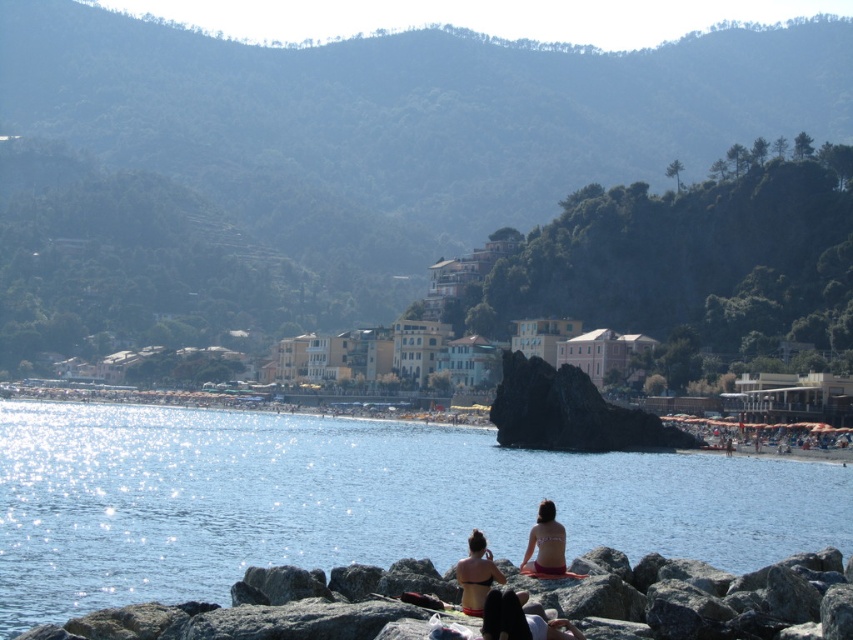
Question: Does blue water at center appear on the right side of matte black bikini top at center?

Choices:
 (A) yes
 (B) no

Answer: (B)

Question: Estimate the real-world distances between objects in this image. Which object is closer to the matte black bikini top at center?

Choices:
 (A) blue water at center
 (B) beige bikini at lower center

Answer: (B)

Question: Does matte black bikini top at center lie in front of beige bikini at lower center?

Choices:
 (A) yes
 (B) no

Answer: (A)

Question: Which object is closer to the camera taking this photo?

Choices:
 (A) beige bikini at lower center
 (B) blue water at center

Answer: (B)

Question: Which of the following is the closest to the observer?

Choices:
 (A) (534, 563)
 (B) (474, 534)
 (C) (416, 541)

Answer: (B)

Question: Is blue water at center further to the viewer compared to matte black bikini top at center?

Choices:
 (A) no
 (B) yes

Answer: (B)